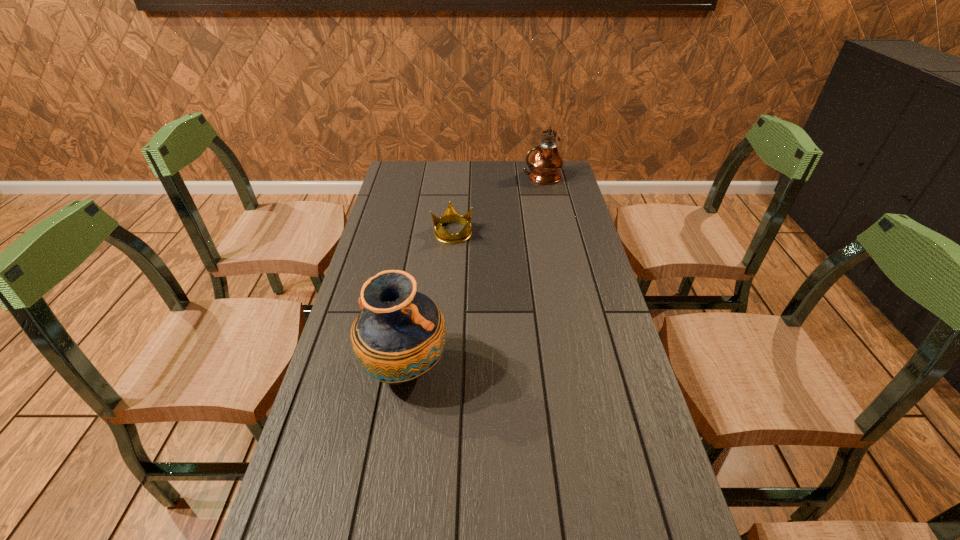
Point out which object is positioned as the second nearest to the nearest object. Please provide its 2D coordinates. Your answer should be formatted as a tuple, i.e. [(x, y)], where the tuple contains the x and y coordinates of a point satisfying the conditions above.

[(545, 165)]

The image size is (960, 540). Identify the location of vacant area in the image that satisfies the following two spatial constraints: 1. on the back side of the rightmost object; 2. on the left side of the shortest object. (457, 177).